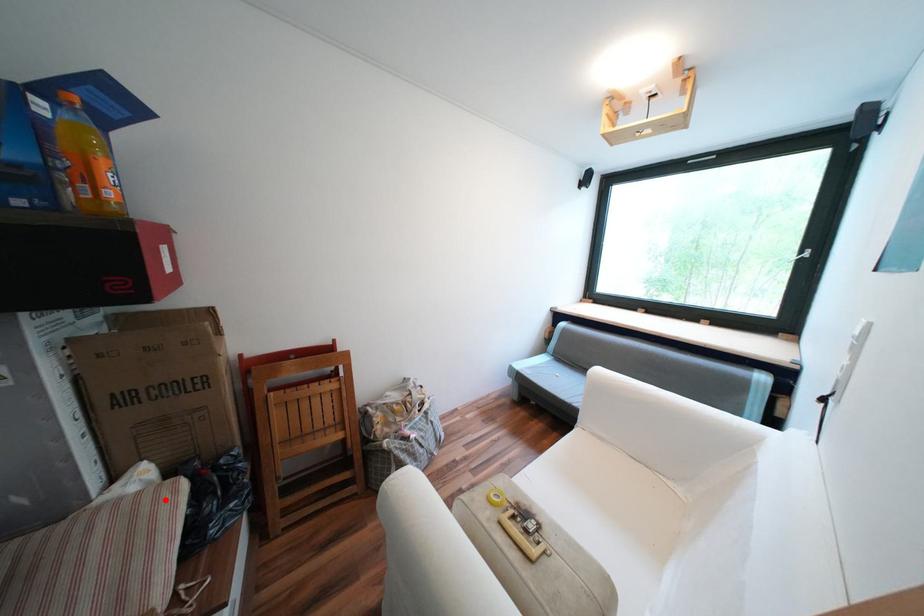
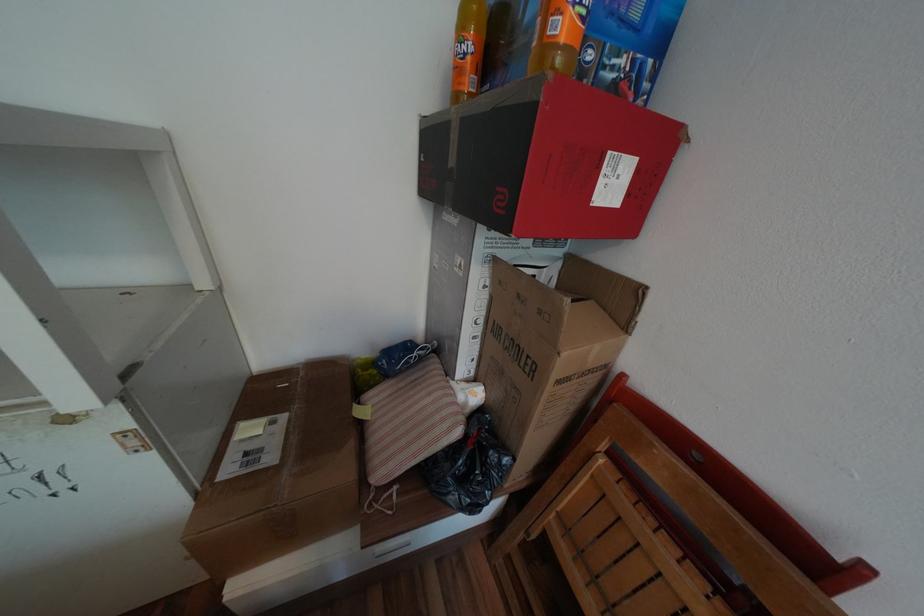
Locate, in the second image, the point that corresponds to the highlighted location in the first image.

(453, 419)